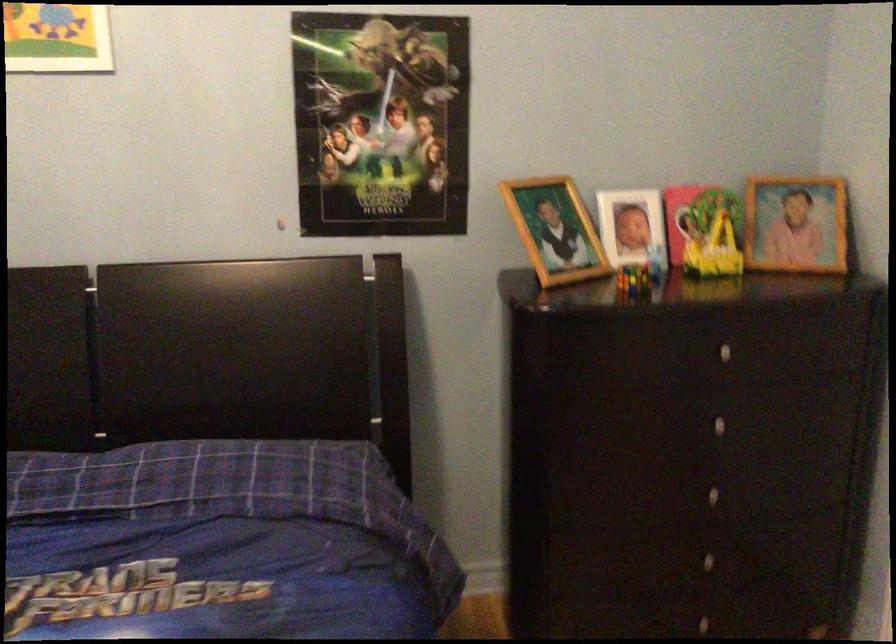
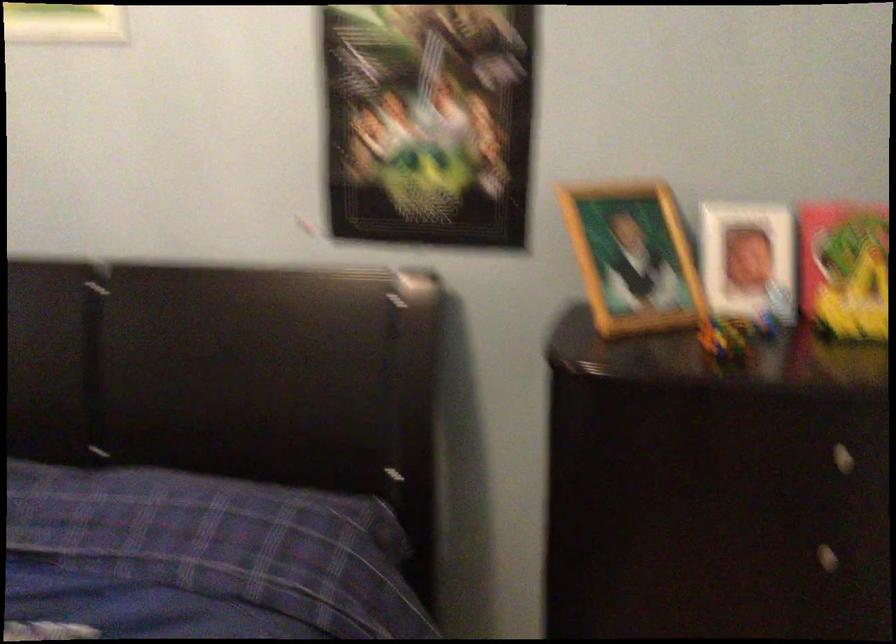
Where in the second image is the point corresponding to point (710, 428) from the first image?

(807, 554)